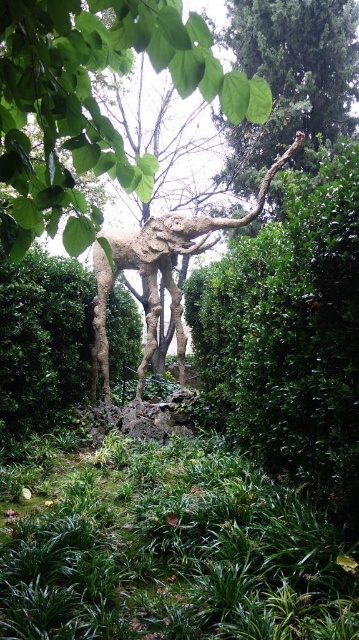
You are standing in the sculpture garden and want to place a small decorative rock. The green leafy grass at lower center is located at point (175, 556). Where should you place the rock to ensure it is near the grass?

Place the rock near the green leafy grass at lower center at point (175, 556) to ensure it is close to the grass.

You are a gardener who needs to place a 6 feet long wooden bench between the green leafy grass at lower center and the sculpture of an elephant. Will the bench fit in the space between them?

The distance between the green leafy grass at lower center and the sculpture of an elephant is 5.99 feet, which is slightly less than the 6 feet length of the bench. Therefore, the bench will not fit in the space between them.